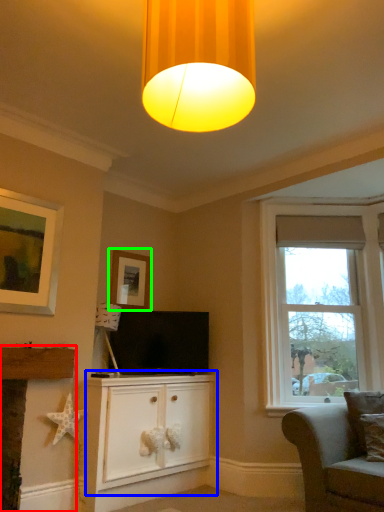
Question: Which object is the closest to the fireplace (highlighted by a red box)? Choose among these: cabinetry (highlighted by a blue box) or picture frame (highlighted by a green box).

Choices:
 (A) cabinetry
 (B) picture frame

Answer: (A)